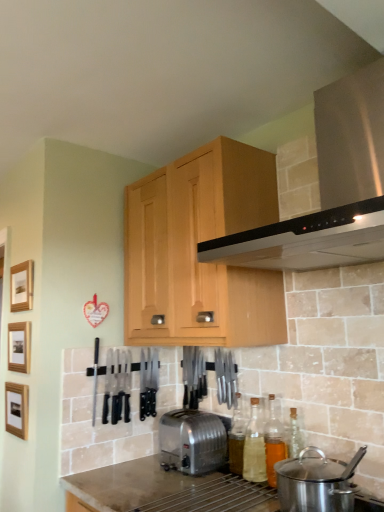
Image resolution: width=384 pixels, height=512 pixels. What do you see at coordinates (192, 441) in the screenshot? I see `satin silver toaster at center` at bounding box center [192, 441].

How much space does wooden picture frame at left, acting as the 1th picture frame starting from the top, occupy horizontally?

The width of wooden picture frame at left, acting as the 1th picture frame starting from the top, is 2.42 centimeters.

This screenshot has height=512, width=384. Describe the element at coordinates (273, 442) in the screenshot. I see `translucent glass bottle at center, the 1th bottle when ordered from right to left` at that location.

What do you see at coordinates (19, 346) in the screenshot? The height and width of the screenshot is (512, 384). I see `wooden picture frame at left, acting as the 2th picture frame starting from the top` at bounding box center [19, 346].

Where is `wooden picture frame at left, acting as the 2th picture frame starting from the top`? The image size is (384, 512). wooden picture frame at left, acting as the 2th picture frame starting from the top is located at coordinates (19, 346).

You are a GUI agent. You are given a task and a screenshot of the screen. Output one action in this format:
    pyautogui.click(x=<x>, y=<y>)
    Task: Click on the clear glass bottle at lower right, acting as the second bottle starting from the right
    
    Given the screenshot: What is the action you would take?
    pyautogui.click(x=254, y=446)

Describe the element at coordinates (17, 409) in the screenshot. I see `wooden picture frame at left, arranged as the third picture frame when viewed from the top` at that location.

Find the location of a particular element. The width and height of the screenshot is (384, 512). satin silver toaster at center is located at coordinates (192, 441).

Considering the positions of objects satin silver toaster at center and translucent glass bottle at center, the 1th bottle when ordered from right to left, in the image provided, who is more to the right, satin silver toaster at center or translucent glass bottle at center, the 1th bottle when ordered from right to left,?

Positioned to the right is translucent glass bottle at center, the 1th bottle when ordered from right to left.

Find the location of a particular element. toaster below the translucent glass bottle at center, acting as the third bottle starting from the left (from the image's perspective) is located at coordinates (192, 441).

Is satin silver toaster at center oriented towards translucent glass bottle at center, acting as the third bottle starting from the left?

No.

Is satin silver toaster at center inside the boundaries of translucent glass bottle at center, acting as the third bottle starting from the left, or outside?

satin silver toaster at center is not enclosed by translucent glass bottle at center, acting as the third bottle starting from the left.

From the image's perspective, is wooden picture frame at left, arranged as the third picture frame when viewed from the top, located above or below translucent glass bottle at center, acting as the third bottle starting from the left?

wooden picture frame at left, arranged as the third picture frame when viewed from the top, is situated higher than translucent glass bottle at center, acting as the third bottle starting from the left, in the image.

In the scene shown: How far apart are wooden picture frame at left, the 1th picture frame ordered from the bottom, and translucent glass bottle at center, acting as the third bottle starting from the left?

They are 1.06 meters apart.

Can you confirm if wooden picture frame at left, arranged as the third picture frame when viewed from the top, is thinner than translucent glass bottle at center, acting as the third bottle starting from the left?

Yes.

Is wooden picture frame at left, acting as the 1th picture frame starting from the top, wider or thinner than light wood cabinet at upper center?

In the image, wooden picture frame at left, acting as the 1th picture frame starting from the top, appears to be more narrow than light wood cabinet at upper center.

This screenshot has height=512, width=384. I want to click on the 1st picture frame below when counting from the light wood cabinet at upper center (from the image's perspective), so click(x=22, y=286).

Considering the relative positions of wooden picture frame at left, acting as the 1th picture frame starting from the top, and light wood cabinet at upper center in the image provided, is wooden picture frame at left, acting as the 1th picture frame starting from the top, to the left of light wood cabinet at upper center from the viewer's perspective?

Yes.

Which is closer to the camera, (24, 279) or (236, 214)?

Positioned in front is point (236, 214).

Is point (233, 415) in front of point (267, 447)?

No.

Is translucent glass bottle at center, the 1th bottle when ordered from right to left, located within translucent glass bottle at center, which is the third bottle from right to left?

No, translucent glass bottle at center, the 1th bottle when ordered from right to left, is not inside translucent glass bottle at center, which is the third bottle from right to left.

Does translucent glass bottle at center, which is the third bottle from right to left, have a larger size compared to translucent glass bottle at center, acting as the third bottle starting from the left?

Incorrect, translucent glass bottle at center, which is the third bottle from right to left, is not larger than translucent glass bottle at center, acting as the third bottle starting from the left.

Based on their sizes in the image, would you say wooden picture frame at left, the 3th picture frame ordered from the bottom, is bigger or smaller than stainless steel range hood at upper center?

wooden picture frame at left, the 3th picture frame ordered from the bottom, is smaller than stainless steel range hood at upper center.

Is stainless steel range hood at upper center completely or partially inside wooden picture frame at left, acting as the 1th picture frame starting from the top?

No.

Does point (27, 307) appear closer or farther from the camera than point (364, 212)?

Point (27, 307) is farther from the camera than point (364, 212).

Measure the distance from wooden picture frame at left, the 3th picture frame ordered from the bottom, to stainless steel range hood at upper center.

They are 4.05 feet apart.

From a real-world perspective, is clear glass bottle at lower right, which ranks as the second bottle in left-to-right order, below satin silver toaster at center?

No, from a real-world perspective, clear glass bottle at lower right, which ranks as the second bottle in left-to-right order, is not beneath satin silver toaster at center.

What's the angular difference between clear glass bottle at lower right, which ranks as the second bottle in left-to-right order, and satin silver toaster at center's facing directions?

They differ by 0.617 degrees in their facing directions.

From the image's perspective, which one is positioned lower, clear glass bottle at lower right, which ranks as the second bottle in left-to-right order, or satin silver toaster at center?

From the image's view, satin silver toaster at center is below.

Is clear glass bottle at lower right, acting as the second bottle starting from the right, far from satin silver toaster at center?

clear glass bottle at lower right, acting as the second bottle starting from the right, is near satin silver toaster at center, not far away.

From the image's perspective, which one is positioned higher, translucent glass bottle at center, the 1th bottle when ordered from right to left, or stainless steel range hood at upper center?

stainless steel range hood at upper center.

Is translucent glass bottle at center, the 1th bottle when ordered from right to left, oriented towards stainless steel range hood at upper center?

No, translucent glass bottle at center, the 1th bottle when ordered from right to left, is not aimed at stainless steel range hood at upper center.

Is translucent glass bottle at center, the 1th bottle when ordered from right to left, to the right of stainless steel range hood at upper center from the viewer's perspective?

No.

From a real-world perspective, is translucent glass bottle at center, the 1th bottle when ordered from right to left, on stainless steel range hood at upper center?

Incorrect, from a real-world perspective, translucent glass bottle at center, the 1th bottle when ordered from right to left, is lower than stainless steel range hood at upper center.

From the image's perspective, starting from the satin silver toaster at center, which bottle is the 3rd one above? Please provide its 2D coordinates.

[(273, 442)]

Locate an element on the screen. The image size is (384, 512). bottle that is the 3rd one when counting forward from the wooden picture frame at left, the 1th picture frame ordered from the bottom is located at coordinates (273, 442).

From the image, which object appears to be farther from clear glass bottle at lower right, which ranks as the second bottle in left-to-right order, wooden picture frame at left, the 1th picture frame ordered from the bottom, or wooden picture frame at left, acting as the 2th picture frame starting from the top?

wooden picture frame at left, acting as the 2th picture frame starting from the top, is further to clear glass bottle at lower right, which ranks as the second bottle in left-to-right order.

From the image, which object appears to be nearer to clear glass bottle at lower right, which ranks as the second bottle in left-to-right order, translucent glass bottle at center, which is the third bottle from right to left, or translucent glass bottle at center, acting as the third bottle starting from the left?

translucent glass bottle at center, acting as the third bottle starting from the left, lies closer to clear glass bottle at lower right, which ranks as the second bottle in left-to-right order, than the other object.

Which object lies nearer to the anchor point wooden picture frame at left, the 3th picture frame ordered from the bottom, wooden picture frame at left, arranged as the third picture frame when viewed from the top, or stainless steel range hood at upper center?

The object closer to wooden picture frame at left, the 3th picture frame ordered from the bottom, is wooden picture frame at left, arranged as the third picture frame when viewed from the top.

Based on their spatial positions, is clear glass bottle at lower right, acting as the second bottle starting from the right, or light wood cabinet at upper center further from wooden picture frame at left, which ranks as the second picture frame in bottom-to-top order?

Based on the image, clear glass bottle at lower right, acting as the second bottle starting from the right, appears to be further to wooden picture frame at left, which ranks as the second picture frame in bottom-to-top order.

Looking at the image, which one is located further to wooden picture frame at left, which ranks as the second picture frame in bottom-to-top order, satin silver toaster at center or translucent glass bottle at center, the first bottle in the left-to-right sequence?

translucent glass bottle at center, the first bottle in the left-to-right sequence, is further to wooden picture frame at left, which ranks as the second picture frame in bottom-to-top order.

Considering their positions, is translucent glass bottle at center, which is the third bottle from right to left, positioned closer to satin silver toaster at center than wooden picture frame at left, the 3th picture frame ordered from the bottom?

translucent glass bottle at center, which is the third bottle from right to left.

When comparing their distances from translucent glass bottle at center, the first bottle in the left-to-right sequence, does satin silver toaster at center or wooden picture frame at left, the 3th picture frame ordered from the bottom, seem further?

wooden picture frame at left, the 3th picture frame ordered from the bottom.

Estimate the real-world distances between objects in this image. Which object is further from wooden picture frame at left, acting as the 2th picture frame starting from the top, stainless steel range hood at upper center or clear glass bottle at lower right, acting as the second bottle starting from the right?

Based on the image, stainless steel range hood at upper center appears to be further to wooden picture frame at left, acting as the 2th picture frame starting from the top.

Locate an element on the screen. The image size is (384, 512). toaster between wooden picture frame at left, acting as the 1th picture frame starting from the top, and stainless steel range hood at upper center from left to right is located at coordinates (192, 441).

Find the location of `toaster situated between wooden picture frame at left, acting as the 2th picture frame starting from the top, and translucent glass bottle at center, acting as the third bottle starting from the left, from left to right`. toaster situated between wooden picture frame at left, acting as the 2th picture frame starting from the top, and translucent glass bottle at center, acting as the third bottle starting from the left, from left to right is located at coordinates (192, 441).

Locate an element on the screen. This screenshot has width=384, height=512. cabinetry between wooden picture frame at left, acting as the 1th picture frame starting from the top, and stainless steel range hood at upper center, in the horizontal direction is located at coordinates (196, 250).

I want to click on toaster between wooden picture frame at left, arranged as the third picture frame when viewed from the top, and light wood cabinet at upper center, so click(x=192, y=441).